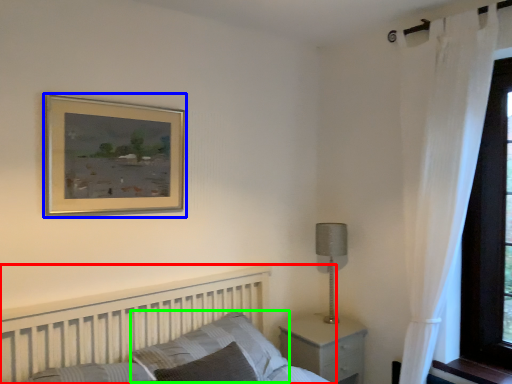
Question: Considering the real-world distances, which object is farthest from bed (highlighted by a red box)? picture frame (highlighted by a blue box) or pillow (highlighted by a green box)?

Choices:
 (A) picture frame
 (B) pillow

Answer: (A)